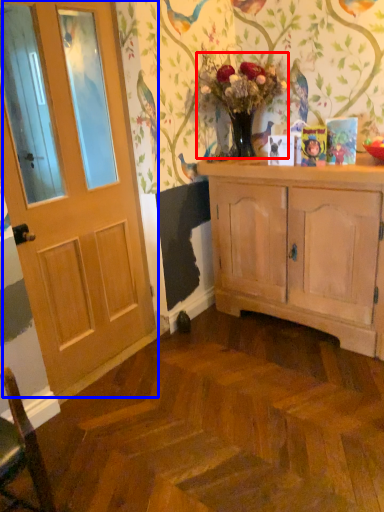
Question: Among these objects, which one is nearest to the camera, floral arrangement (highlighted by a red box) or door (highlighted by a blue box)?

Choices:
 (A) floral arrangement
 (B) door

Answer: (B)